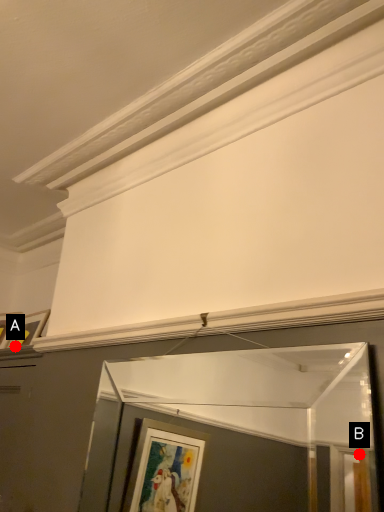
Question: Two points are circled on the image, labeled by A and B beside each circle. Which point is closer to the camera?

Choices:
 (A) A is closer
 (B) B is closer

Answer: (A)